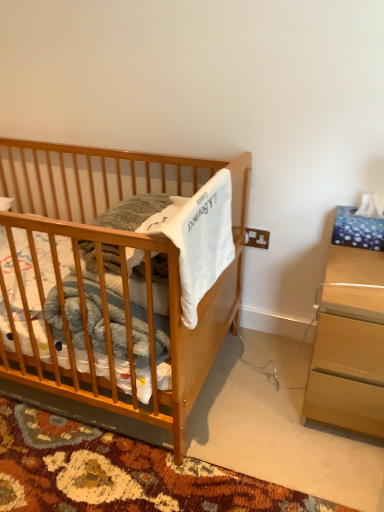
At what (x,y) coordinates should I click in order to perform the action: click on light brown wood nightstand at right. Please return your answer as a coordinate pair (x, y). Looking at the image, I should click on (350, 334).

Describe the element at coordinates (350, 334) in the screenshot. I see `light brown wood nightstand at right` at that location.

What do you see at coordinates (121, 269) in the screenshot? I see `light brown wooden crib at left` at bounding box center [121, 269].

The height and width of the screenshot is (512, 384). I want to click on light brown wooden crib at left, so click(121, 269).

The width and height of the screenshot is (384, 512). I want to click on light brown wood nightstand at right, so click(x=350, y=334).

Between light brown wooden crib at left and light brown wood nightstand at right, which one appears on the left side from the viewer's perspective?

Positioned to the left is light brown wooden crib at left.

From the picture: Considering their positions, is light brown wooden crib at left located in front of or behind light brown wood nightstand at right?

Visually, light brown wooden crib at left is located in front of light brown wood nightstand at right.

Is point (13, 376) positioned after point (333, 263)?

No, it is not.

From the image's perspective, is light brown wooden crib at left located above or below light brown wood nightstand at right?

Clearly, from the image's perspective, light brown wooden crib at left is above light brown wood nightstand at right.

From a real-world perspective, is light brown wooden crib at left physically located above or below light brown wood nightstand at right?

light brown wooden crib at left is situated higher than light brown wood nightstand at right in the real world.

Looking at their sizes, would you say light brown wooden crib at left is wider or thinner than light brown wood nightstand at right?

light brown wooden crib at left is wider than light brown wood nightstand at right.

Which of these two, light brown wooden crib at left or light brown wood nightstand at right, stands shorter?

light brown wood nightstand at right.

Considering the relative sizes of light brown wooden crib at left and light brown wood nightstand at right in the image provided, is light brown wooden crib at left bigger than light brown wood nightstand at right?

Yes.

Based on the photo, would you say light brown wooden crib at left contains light brown wood nightstand at right?

No, light brown wood nightstand at right is not a part of light brown wooden crib at left.

Is there a large distance between light brown wooden crib at left and light brown wood nightstand at right?

That's not correct — light brown wooden crib at left is a little close to light brown wood nightstand at right.

Is light brown wood nightstand at right at the back of light brown wooden crib at left?

light brown wooden crib at left is not turned away from light brown wood nightstand at right.

Consider the image. How different are the orientations of light brown wooden crib at left and light brown wood nightstand at right in degrees?

0.000346 degrees.

At what (x,y) coordinates should I click in order to perform the action: click on infant bed that is above the light brown wood nightstand at right (from a real-world perspective). Please return your answer as a coordinate pair (x, y). The height and width of the screenshot is (512, 384). Looking at the image, I should click on (121, 269).

Considering the positions of objects light brown wood nightstand at right and light brown wooden crib at left in the image provided, who is more to the right, light brown wood nightstand at right or light brown wooden crib at left?

Positioned to the right is light brown wood nightstand at right.

In the image, is light brown wood nightstand at right positioned in front of or behind light brown wooden crib at left?

light brown wood nightstand at right is positioned farther from the viewer than light brown wooden crib at left.

Considering the positions of point (369, 315) and point (55, 265), is point (369, 315) closer or farther from the camera than point (55, 265)?

Point (369, 315) appears to be farther away from the viewer than point (55, 265).

From the image's perspective, which is above, light brown wood nightstand at right or light brown wooden crib at left?

light brown wooden crib at left, from the image's perspective.

From a real-world perspective, is light brown wood nightstand at right positioned above or below light brown wooden crib at left?

From a real-world perspective, light brown wood nightstand at right is physically below light brown wooden crib at left.

Can you confirm if light brown wood nightstand at right is thinner than light brown wooden crib at left?

Yes.

Can you confirm if light brown wood nightstand at right is shorter than light brown wooden crib at left?

Yes, light brown wood nightstand at right is shorter than light brown wooden crib at left.

Does light brown wood nightstand at right have a larger size compared to light brown wooden crib at left?

No, light brown wood nightstand at right is not bigger than light brown wooden crib at left.

Is light brown wooden crib at left located within light brown wood nightstand at right?

No, light brown wood nightstand at right does not contain light brown wooden crib at left.

Consider the image. Is there a large distance between light brown wood nightstand at right and light brown wooden crib at left?

No, light brown wood nightstand at right is not far from light brown wooden crib at left.

Does light brown wood nightstand at right turn towards light brown wooden crib at left?

No, light brown wood nightstand at right does not turn towards light brown wooden crib at left.

How many degrees apart are the facing directions of light brown wood nightstand at right and light brown wooden crib at left?

0.000346 degrees.

In the image, there is a light brown wood nightstand at right. At what (x,y) coordinates should I click in order to perform the action: click on infant bed above it (from the image's perspective). Please return your answer as a coordinate pair (x, y). Looking at the image, I should click on (121, 269).

Locate an element on the screen. The width and height of the screenshot is (384, 512). infant bed that appears above the light brown wood nightstand at right (from the image's perspective) is located at coordinates (121, 269).

I want to click on infant bed lying on the left of light brown wood nightstand at right, so click(121, 269).